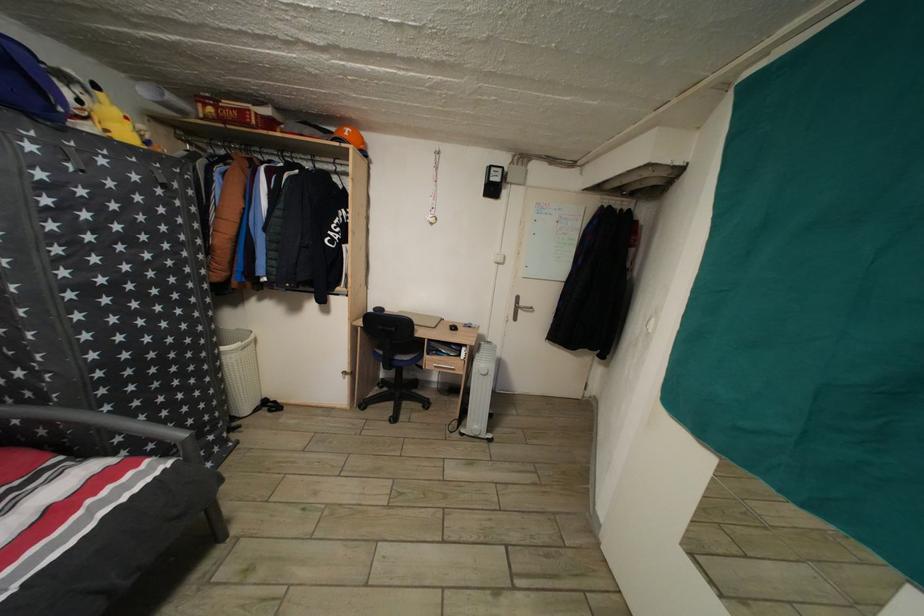
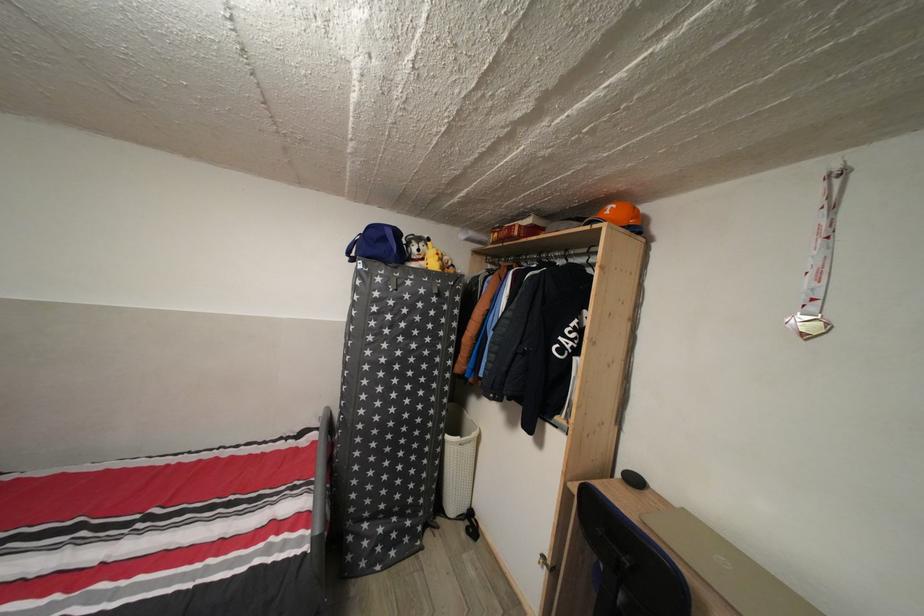
In the second image, find the point that corresponds to (x=229, y=355) in the first image.

(455, 444)